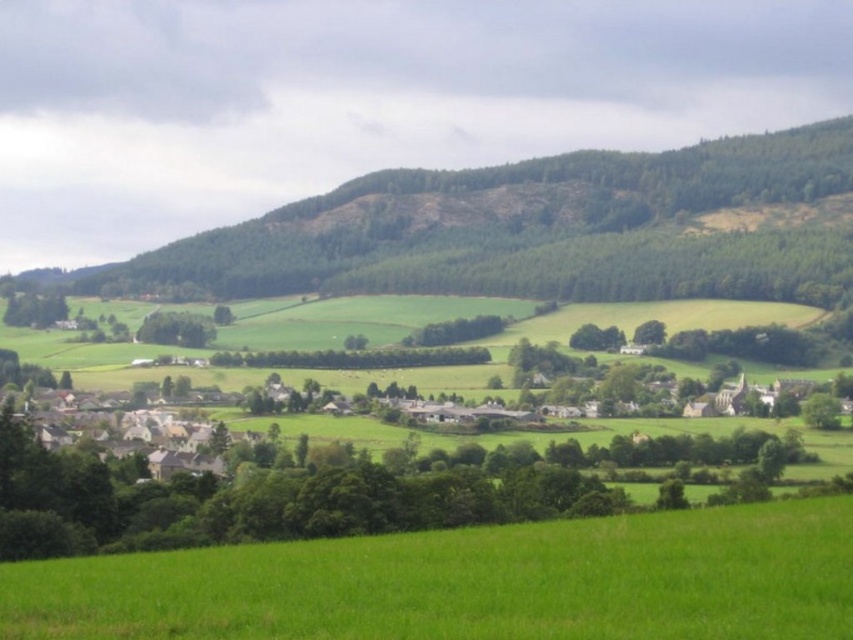
You are a hiker planning to take a photo of the green forested hill at upper center and the green leafy tree at lower left from a distance. Which object will appear bigger in your photo?

The green forested hill at upper center will appear bigger in the photo because it has a larger size compared to the green leafy tree at lower left.